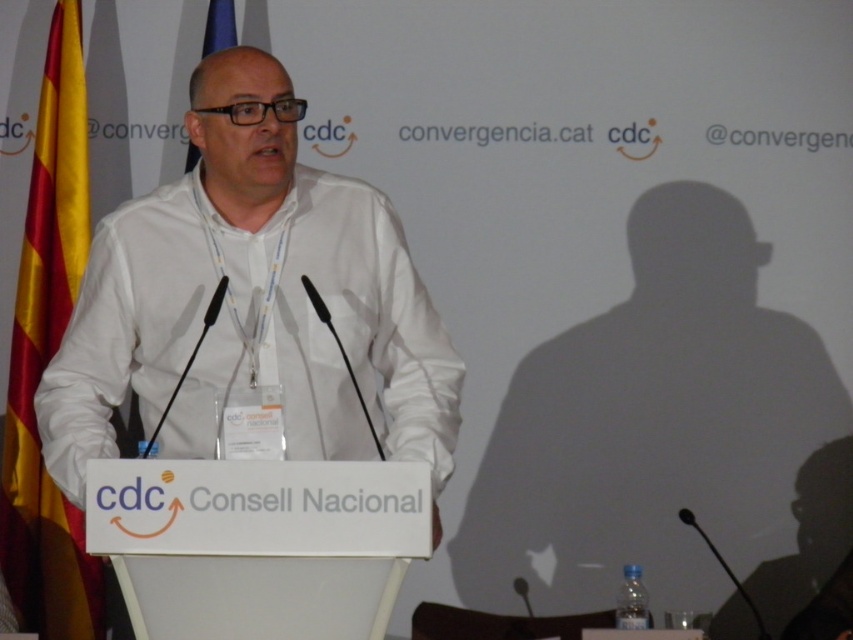
Question: Does white matte shirt at center appear under yellow/red striped fabric at left?

Choices:
 (A) yes
 (B) no

Answer: (B)

Question: Can you confirm if white matte shirt at center is positioned to the right of yellow/red striped fabric at left?

Choices:
 (A) no
 (B) yes

Answer: (B)

Question: Can you confirm if white matte shirt at center is smaller than yellow/red striped fabric at left?

Choices:
 (A) yes
 (B) no

Answer: (B)

Question: Which object is farther from the camera taking this photo?

Choices:
 (A) white matte shirt at center
 (B) yellow/red striped fabric at left

Answer: (B)